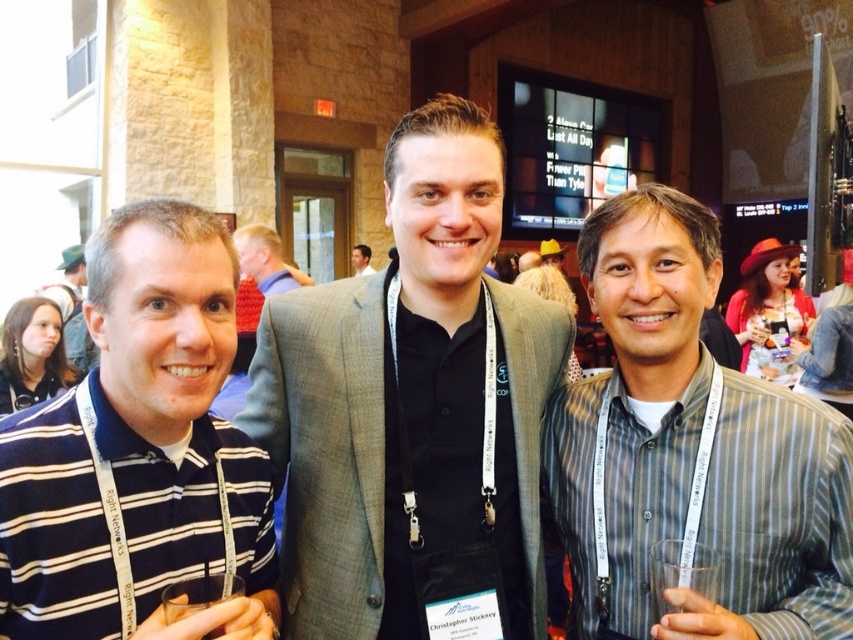
How much distance is there between matte black shirt at left and light brown hair at center?

They are 4.86 feet apart.

Between point (86, 346) and point (279, 276), which one is positioned behind?

Point (86, 346)

Is point (80, 337) less distant than point (242, 260)?

No, it is behind (242, 260).

At what (x,y) coordinates should I click in order to perform the action: click on matte black shirt at left. Please return your answer as a coordinate pair (x, y). The width and height of the screenshot is (853, 640). Looking at the image, I should click on point(73,308).

How much distance is there between blue striped polo shirt at center and smooth black shirt at center?

A distance of 6.26 meters exists between blue striped polo shirt at center and smooth black shirt at center.

Can you confirm if blue striped polo shirt at center is wider than smooth black shirt at center?

Yes, blue striped polo shirt at center is wider than smooth black shirt at center.

Image resolution: width=853 pixels, height=640 pixels. What do you see at coordinates (138, 451) in the screenshot?
I see `blue striped polo shirt at center` at bounding box center [138, 451].

In order to click on blue striped polo shirt at center in this screenshot , I will do `click(138, 451)`.

Which is above, gray striped shirt at center or smooth black shirt at center?

Positioned higher is smooth black shirt at center.

Between gray striped shirt at center and smooth black shirt at center, which one appears on the left side from the viewer's perspective?

Positioned to the left is smooth black shirt at center.

At what (x,y) coordinates should I click in order to perform the action: click on gray striped shirt at center. Please return your answer as a coordinate pair (x, y). The width and height of the screenshot is (853, 640). Looking at the image, I should click on (689, 451).